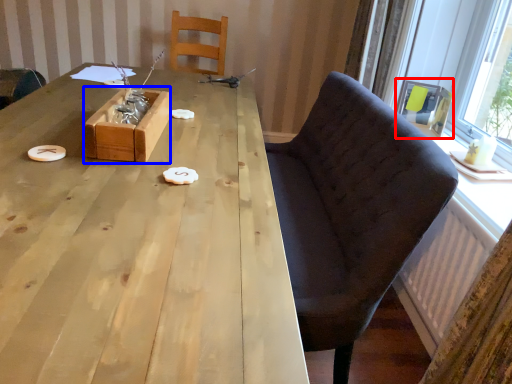
Question: Among these objects, which one is farthest to the camera, armchair (highlighted by a red box) or box (highlighted by a blue box)?

Choices:
 (A) armchair
 (B) box

Answer: (A)